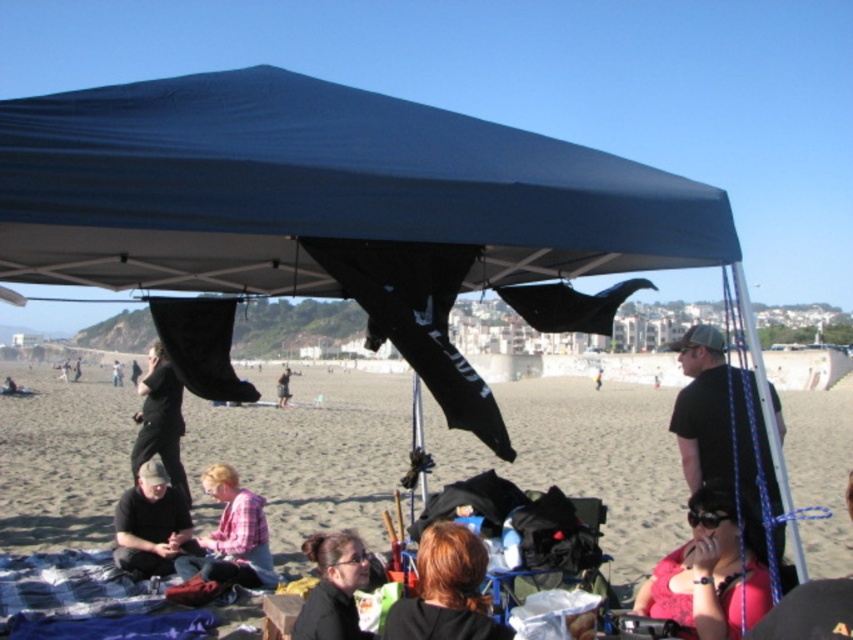
Question: Which point appears closest to the camera in this image?

Choices:
 (A) (705, 502)
 (B) (263, 570)

Answer: (A)

Question: Does pink plaid shirt at lower center come behind black fabric at center?

Choices:
 (A) no
 (B) yes

Answer: (A)

Question: Does matte pink shirt at lower right appear over black matte hair at lower center?

Choices:
 (A) no
 (B) yes

Answer: (B)

Question: Considering the real-world distances, which object is closest to the black matte t-shirt at right?

Choices:
 (A) dark brown hair at lower center
 (B) black fabric at center

Answer: (A)

Question: Which point is closer to the camera taking this photo?

Choices:
 (A) (114, 404)
 (B) (686, 600)
 (C) (717, 456)

Answer: (B)

Question: Is beige sand at lower center closer to the viewer compared to black matte hair at lower center?

Choices:
 (A) yes
 (B) no

Answer: (B)